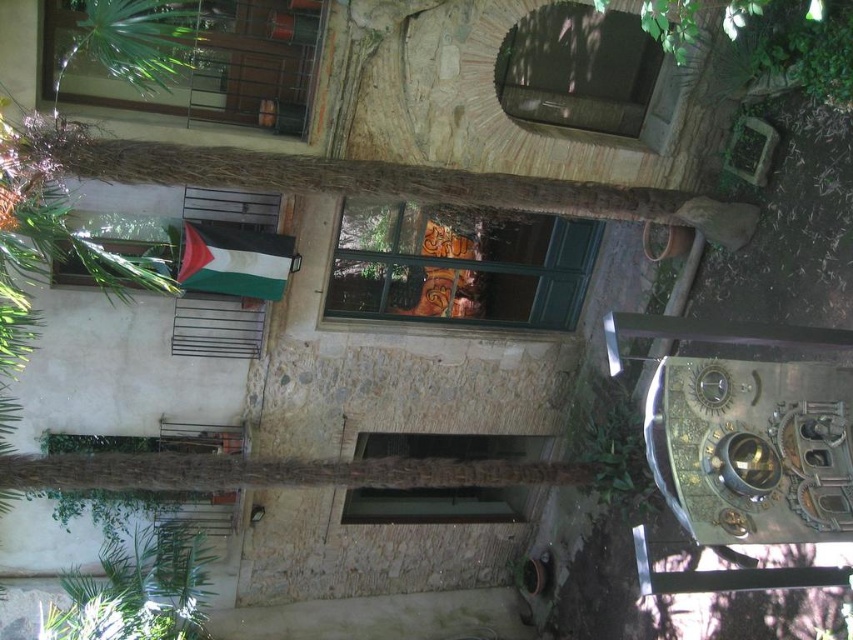
Can you confirm if green glass window at center is positioned below transparent glass window at center?

Actually, green glass window at center is above transparent glass window at center.

Which is behind, point (426, 282) or point (453, 520)?

The point (453, 520) is more distant.

You are a GUI agent. You are given a task and a screenshot of the screen. Output one action in this format:
    pyautogui.click(x=<x>, y=<y>)
    Task: Click on the green glass window at center
    
    Given the screenshot: What is the action you would take?
    pyautogui.click(x=459, y=268)

Can you confirm if green leafy tree at lower left is wider than green fabric flag at center?

Correct, the width of green leafy tree at lower left exceeds that of green fabric flag at center.

Image resolution: width=853 pixels, height=640 pixels. What are the coordinates of `green leafy tree at lower left` in the screenshot? It's located at (138, 589).

Can you confirm if green glass window at center is shorter than matte glass window at upper center?

Yes.

Which is in front, point (527, 268) or point (527, 38)?

Point (527, 38)

Between point (537, 228) and point (641, 88), which one is positioned behind?

The point (537, 228) is more distant.

Identify the location of green glass window at center. The height and width of the screenshot is (640, 853). (459, 268).